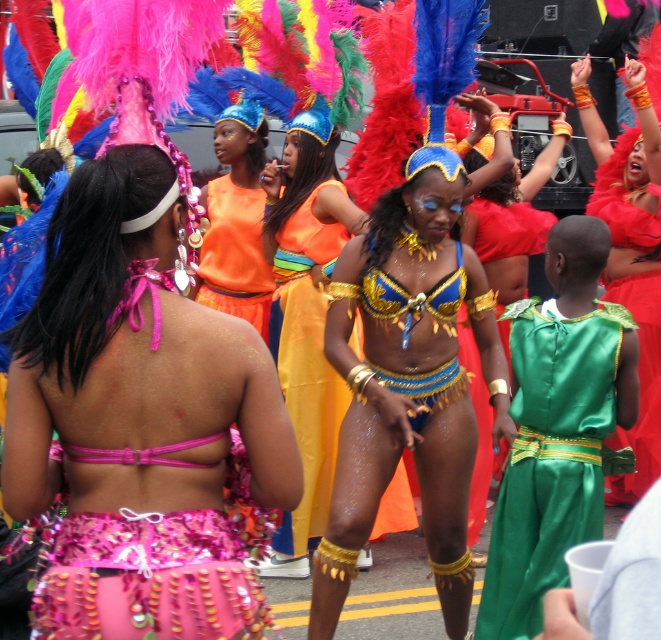
Between point (563, 380) and point (584, 58), which one is positioned behind?

The point (584, 58) is behind.

Is point (594, 381) positioned behind point (644, 157)?

That is False.

Does point (500, 496) come behind point (631, 61)?

No.

This screenshot has height=640, width=661. What are the coordinates of `green satin dress at lower right` in the screenshot? It's located at (551, 460).

Is shiny pink bikini top at center shorter than orange fabric skirt at center?

In fact, shiny pink bikini top at center may be taller than orange fabric skirt at center.

Locate an element on the screen. The height and width of the screenshot is (640, 661). shiny pink bikini top at center is located at coordinates (137, 420).

Find the location of `shiny pink bikini top at center`. shiny pink bikini top at center is located at coordinates [x=137, y=420].

The height and width of the screenshot is (640, 661). I want to click on shiny pink bikini top at center, so pos(137,420).

Who is taller, green satin dress at lower right or shiny gold bikini at center?

Standing taller between the two is shiny gold bikini at center.

In the scene shown: Between green satin dress at lower right and shiny gold bikini at center, which one is positioned lower?

Positioned lower is green satin dress at lower right.

Is point (531, 604) positioned behind point (290, 353)?

No, (531, 604) is closer to viewer.

You are a GUI agent. You are given a task and a screenshot of the screen. Output one action in this format:
    pyautogui.click(x=<x>, y=<y>)
    Task: Click on the green satin dress at lower right
    
    Given the screenshot: What is the action you would take?
    pyautogui.click(x=551, y=460)